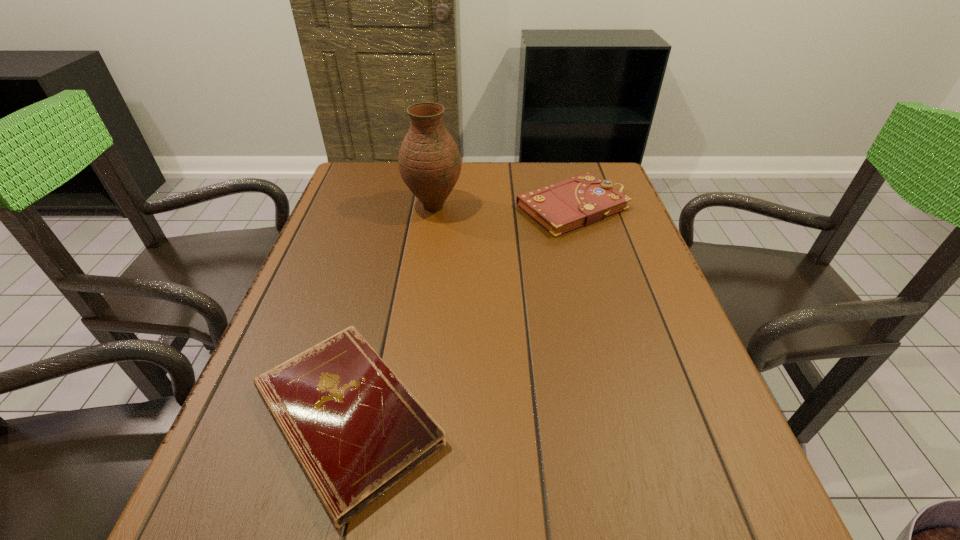
The width and height of the screenshot is (960, 540). Find the location of `vacant space at the far right corner`. vacant space at the far right corner is located at coordinates (592, 169).

You are a GUI agent. You are given a task and a screenshot of the screen. Output one action in this format:
    pyautogui.click(x=<x>, y=<y>)
    Task: Click on the empty location between the shorter notebook and the vase
    The width and height of the screenshot is (960, 540).
    Given the screenshot: What is the action you would take?
    pyautogui.click(x=390, y=312)

Find the location of a particular element. The height and width of the screenshot is (540, 960). free spot between the right notebook and the tallest object is located at coordinates (503, 207).

Locate an element on the screen. free space between the vase and the shorter notebook is located at coordinates (390, 312).

This screenshot has height=540, width=960. I want to click on free space between the nearer notebook and the rightmost object, so click(460, 312).

Locate an element on the screen. The image size is (960, 540). empty space between the right notebook and the tallest object is located at coordinates (503, 207).

Image resolution: width=960 pixels, height=540 pixels. Identify the location of vacant space that is in between the left notebook and the taller notebook. (460, 312).

Image resolution: width=960 pixels, height=540 pixels. I want to click on vacant point located between the rightmost object and the vase, so click(x=503, y=207).

Find the location of `vacant space that is in between the tallest object and the shortest object`. vacant space that is in between the tallest object and the shortest object is located at coordinates (390, 312).

In order to click on free spot between the right notebook and the left notebook in this screenshot , I will do `click(460, 312)`.